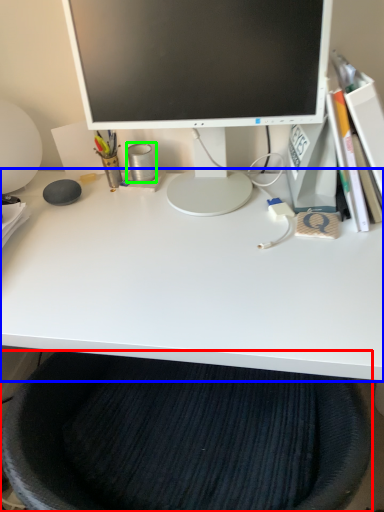
Question: Which object is the farthest from computer chair (highlighted by a red box)? Choose among these: desk (highlighted by a blue box) or stationery (highlighted by a green box).

Choices:
 (A) desk
 (B) stationery

Answer: (B)